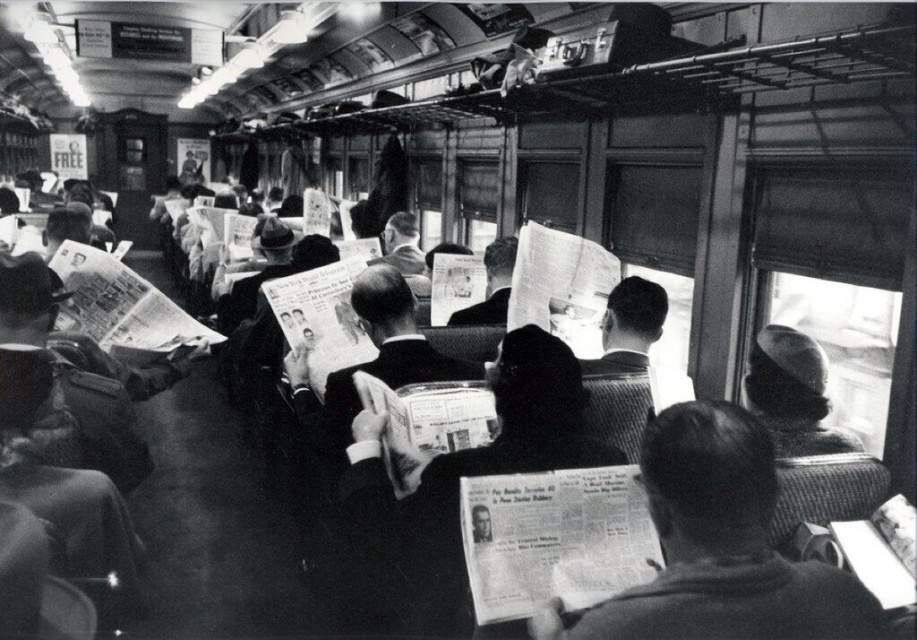
Question: Among these points, which one is farthest from the camera?

Choices:
 (A) (797, 417)
 (B) (824, 589)

Answer: (A)

Question: Which point is closer to the camera?

Choices:
 (A) smooth gray hat at right
 (B) smooth black coat at center

Answer: (B)

Question: Is smooth black coat at center above smooth gray hat at right?

Choices:
 (A) yes
 (B) no

Answer: (B)

Question: Considering the relative positions of smooth black coat at center and smooth gray hat at right in the image provided, where is smooth black coat at center located with respect to smooth gray hat at right?

Choices:
 (A) left
 (B) right

Answer: (A)

Question: Does smooth black coat at center have a larger size compared to smooth gray hat at right?

Choices:
 (A) no
 (B) yes

Answer: (B)